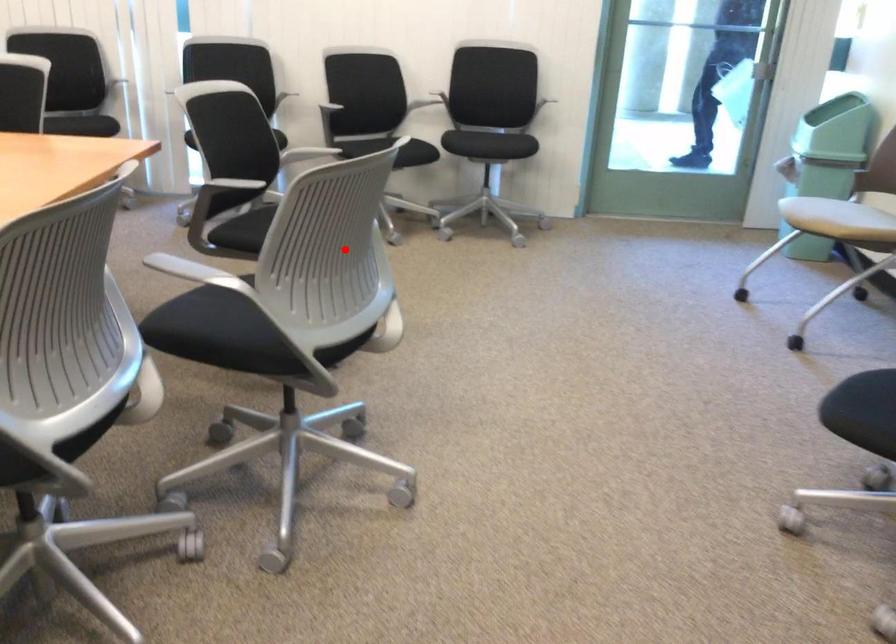
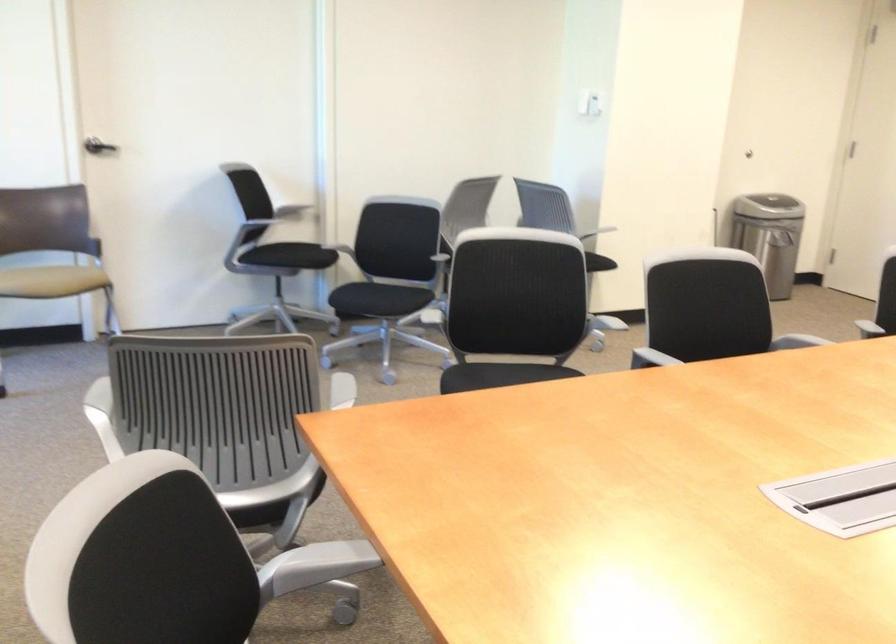
Question: I am providing you with two images of the same scene from different viewpoints. In image1, a red point is highlighted. Considering the same 3D point in image2, which of the following is correct?

Choices:
 (A) It is closer
 (B) It is farther

Answer: (B)